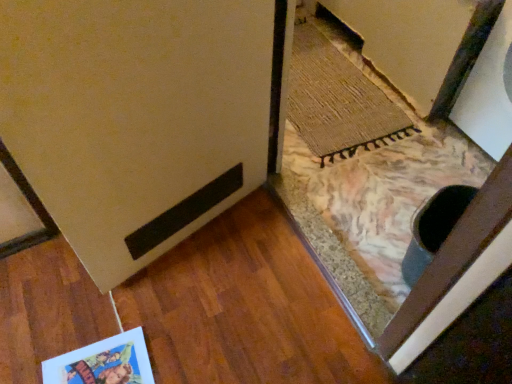
What do you see at coordinates (103, 362) in the screenshot? This screenshot has height=384, width=512. I see `matte cardboard postcard at lower left` at bounding box center [103, 362].

The image size is (512, 384). I want to click on matte cardboard postcard at lower left, so click(103, 362).

Is matte beige door at lower left not inside rug at lower right?

Yes, matte beige door at lower left is outside of rug at lower right.

Is point (69, 93) more distant than point (318, 142)?

No, it is in front of (318, 142).

How different are the orientations of matte beige door at lower left and rug at lower right in degrees?

They differ by 112 degrees in their facing directions.

Where is `doormat that appears behind the matte beige door at lower left`? The height and width of the screenshot is (384, 512). doormat that appears behind the matte beige door at lower left is located at coordinates (338, 101).

From a real-world perspective, which object stands above the other?

matte cardboard postcard at lower left, from a real-world perspective.

Locate an element on the screen. doormat on the right of matte cardboard postcard at lower left is located at coordinates (338, 101).

In the image, is rug at lower right on the left side or the right side of matte cardboard postcard at lower left?

rug at lower right is to the right of matte cardboard postcard at lower left.

Is rug at lower right wider than matte beige door at lower left?

Indeed, rug at lower right has a greater width compared to matte beige door at lower left.

Between rug at lower right and matte beige door at lower left, which one has larger size?

Bigger between the two is matte beige door at lower left.

Are rug at lower right and matte beige door at lower left far apart?

Actually, rug at lower right and matte beige door at lower left are a little close together.

Does rug at lower right lie in front of matte beige door at lower left?

No, it is behind matte beige door at lower left.

Considering their positions, is matte beige door at lower left located in front of or behind matte cardboard postcard at lower left?

Visually, matte beige door at lower left is located in front of matte cardboard postcard at lower left.

Is matte beige door at lower left located outside matte cardboard postcard at lower left?

Yes, matte beige door at lower left is outside of matte cardboard postcard at lower left.

From a real-world perspective, which is physically above, matte beige door at lower left or matte cardboard postcard at lower left?

matte beige door at lower left.

Does point (185, 71) come behind point (118, 365)?

No, it is not.

Considering the positions of objects matte cardboard postcard at lower left and rug at lower right in the image provided, who is in front, matte cardboard postcard at lower left or rug at lower right?

matte cardboard postcard at lower left is in front.

Considering the relative sizes of matte cardboard postcard at lower left and rug at lower right in the image provided, is matte cardboard postcard at lower left taller than rug at lower right?

Correct, matte cardboard postcard at lower left is much taller as rug at lower right.

From the image's perspective, which one is positioned higher, matte cardboard postcard at lower left or rug at lower right?

From the image's view, rug at lower right is above.

What's the angular difference between matte cardboard postcard at lower left and rug at lower right's facing directions?

172 degrees separate the facing orientations of matte cardboard postcard at lower left and rug at lower right.

Can you confirm if matte cardboard postcard at lower left is bigger than matte beige door at lower left?

No.

Is matte cardboard postcard at lower left to the right of matte beige door at lower left from the viewer's perspective?

In fact, matte cardboard postcard at lower left is to the left of matte beige door at lower left.

Does point (127, 351) come closer to viewer compared to point (112, 183)?

That is False.

Is matte cardboard postcard at lower left next to matte beige door at lower left?

No.

Where is `door positioned vertically above the rug at lower right (from a real-world perspective)`? The height and width of the screenshot is (384, 512). door positioned vertically above the rug at lower right (from a real-world perspective) is located at coordinates (141, 116).

Find the location of a particular element. This screenshot has height=384, width=512. doormat on the right of matte cardboard postcard at lower left is located at coordinates click(x=338, y=101).

From the image, which object appears to be farther from matte beige door at lower left, rug at lower right or matte cardboard postcard at lower left?

The object further to matte beige door at lower left is rug at lower right.

From the image, which object appears to be nearer to matte beige door at lower left, matte cardboard postcard at lower left or rug at lower right?

Among the two, matte cardboard postcard at lower left is located nearer to matte beige door at lower left.

Based on their spatial positions, is matte beige door at lower left or rug at lower right closer to matte cardboard postcard at lower left?

matte beige door at lower left is closer to matte cardboard postcard at lower left.

When comparing their distances from rug at lower right, does matte cardboard postcard at lower left or matte beige door at lower left seem further?

matte cardboard postcard at lower left is further to rug at lower right.

Looking at the image, which one is located further to rug at lower right, matte beige door at lower left or matte cardboard postcard at lower left?

Among the two, matte cardboard postcard at lower left is located further to rug at lower right.

Considering their positions, is rug at lower right positioned further to matte cardboard postcard at lower left than matte beige door at lower left?

rug at lower right lies further to matte cardboard postcard at lower left than the other object.

You are a GUI agent. You are given a task and a screenshot of the screen. Output one action in this format:
    pyautogui.click(x=<x>, y=<y>)
    Task: Click on the postcard between matte beige door at lower left and rug at lower right from front to back
    Image resolution: width=512 pixels, height=384 pixels.
    Given the screenshot: What is the action you would take?
    pyautogui.click(x=103, y=362)